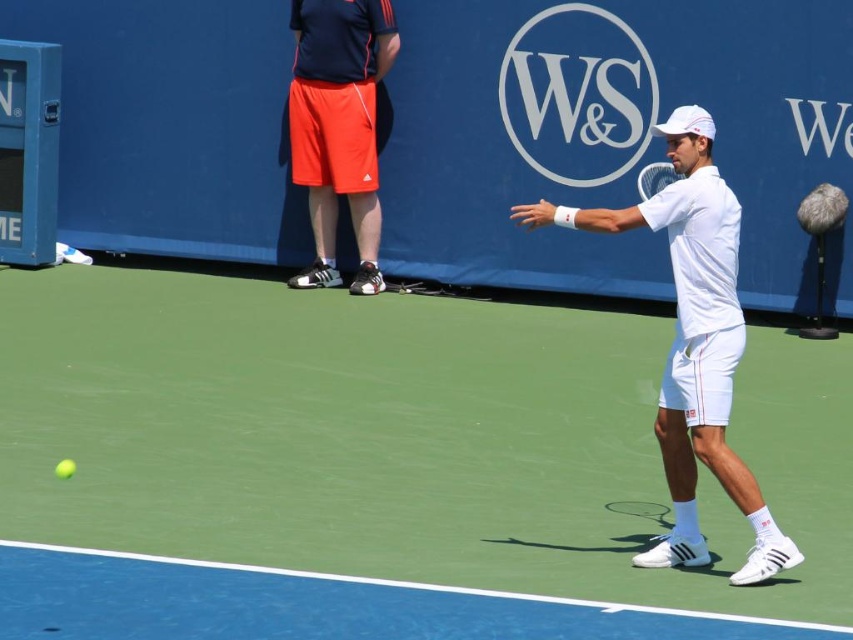
Is green synthetic turf at center above orange cotton shorts at upper left?

No.

Locate an element on the screen. The width and height of the screenshot is (853, 640). green synthetic turf at center is located at coordinates (383, 465).

Which of these two, white matte tennis racket at center or yellow matte tennis ball at lower left, stands taller?

white matte tennis racket at center

Is white matte tennis racket at center taller than yellow matte tennis ball at lower left?

Correct, white matte tennis racket at center is much taller as yellow matte tennis ball at lower left.

Is point (653, 192) closer to camera compared to point (74, 465)?

No.

The width and height of the screenshot is (853, 640). In order to click on white matte tennis racket at center in this screenshot , I will do `click(654, 179)`.

Does green synthetic turf at center come behind white matte tennis racket at center?

No, green synthetic turf at center is in front of white matte tennis racket at center.

Between point (503, 500) and point (660, 184), which one is positioned in front?

Positioned in front is point (503, 500).

Is point (819, 497) more distant than point (642, 186)?

That is False.

Where is `green synthetic turf at center`? The width and height of the screenshot is (853, 640). green synthetic turf at center is located at coordinates (383, 465).